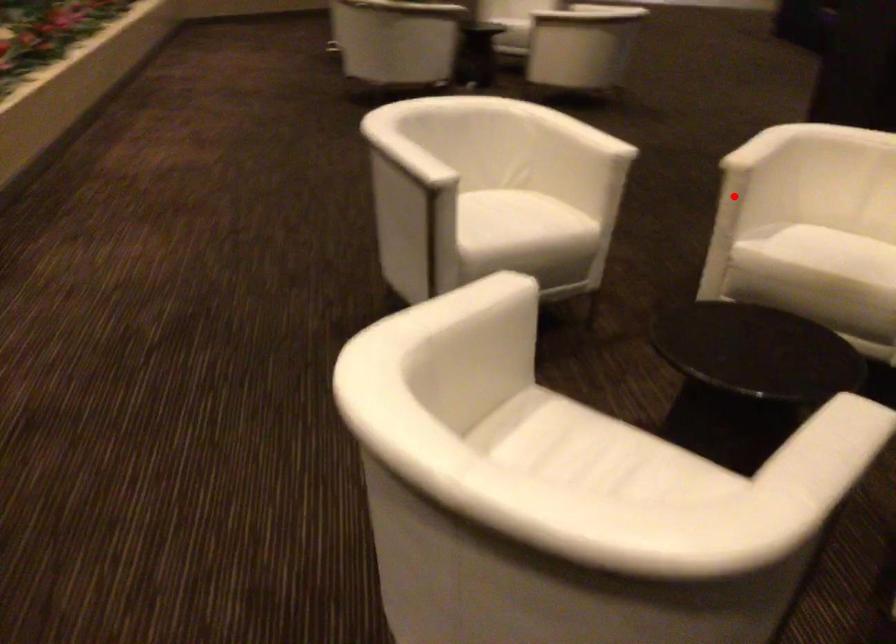
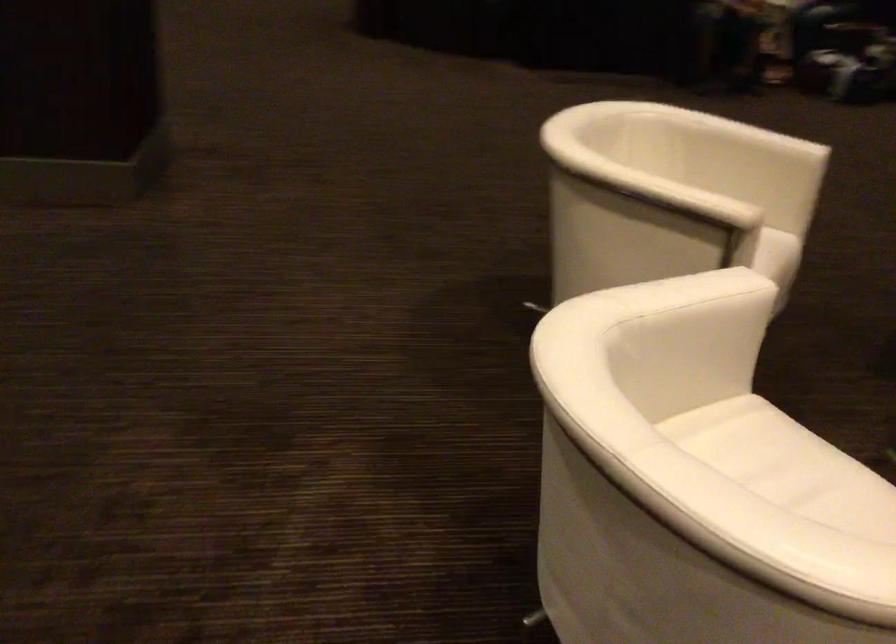
Question: I am providing you with two images of the same scene from different viewpoints. In image1, a red point is highlighted. Considering the same 3D point in image2, which of the following is correct?

Choices:
 (A) It is closer
 (B) It is farther

Answer: (A)